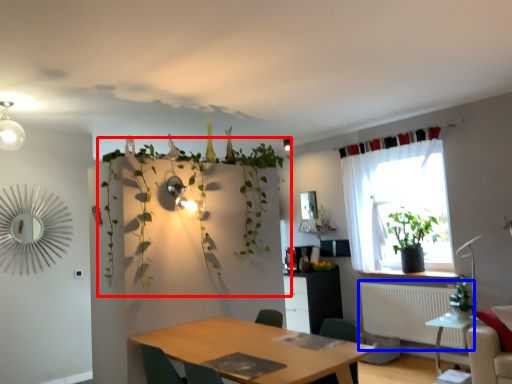
Question: Which point is closer to the camera, vegetation (highlighted by a red box) or radiator (highlighted by a blue box)?

Choices:
 (A) vegetation
 (B) radiator

Answer: (A)